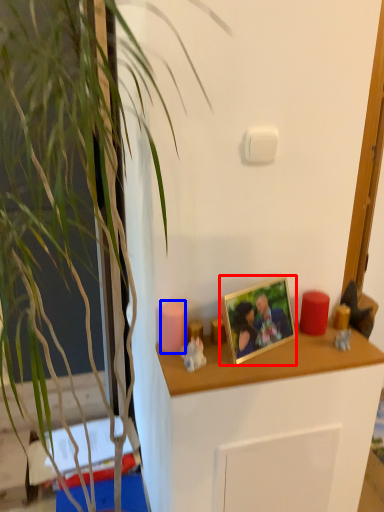
Question: Among these objects, which one is farthest to the camera, picture frame (highlighted by a red box) or candle (highlighted by a blue box)?

Choices:
 (A) picture frame
 (B) candle

Answer: (B)